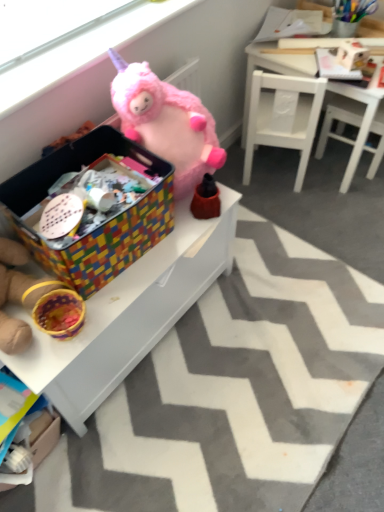
The height and width of the screenshot is (512, 384). What are the coordinates of `free area in between multicolored woven basket at left, which is the third toy in top-to-bottom order, and brown matte toy at center, which is the second toy in bottom-to-top order` in the screenshot? It's located at (145, 266).